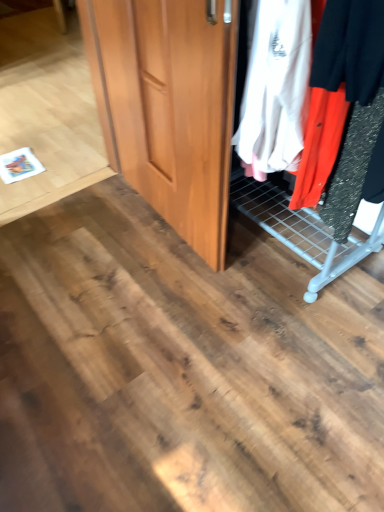
Question: Is wooden door at center not inside wooden wardrobe at center?

Choices:
 (A) yes
 (B) no

Answer: (A)

Question: From the image's perspective, does wooden door at center appear lower than wooden wardrobe at center?

Choices:
 (A) no
 (B) yes

Answer: (B)

Question: Is wooden door at center aimed at wooden wardrobe at center?

Choices:
 (A) yes
 (B) no

Answer: (B)

Question: Is wooden door at center not close to wooden wardrobe at center?

Choices:
 (A) yes
 (B) no

Answer: (B)

Question: From the image's perspective, does wooden door at center appear higher than wooden wardrobe at center?

Choices:
 (A) yes
 (B) no

Answer: (B)

Question: From a real-world perspective, is wooden door at center beneath wooden wardrobe at center?

Choices:
 (A) no
 (B) yes

Answer: (B)

Question: Is wooden wardrobe at center facing towards wooden door at center?

Choices:
 (A) yes
 (B) no

Answer: (A)

Question: Is wooden wardrobe at center in front of wooden door at center?

Choices:
 (A) yes
 (B) no

Answer: (A)

Question: From a real-world perspective, is wooden wardrobe at center positioned under wooden door at center based on gravity?

Choices:
 (A) yes
 (B) no

Answer: (B)

Question: Is wooden wardrobe at center directly adjacent to wooden door at center?

Choices:
 (A) no
 (B) yes

Answer: (A)

Question: Considering the relative sizes of wooden wardrobe at center and wooden door at center in the image provided, is wooden wardrobe at center thinner than wooden door at center?

Choices:
 (A) yes
 (B) no

Answer: (B)

Question: Considering the relative sizes of wooden wardrobe at center and wooden door at center in the image provided, is wooden wardrobe at center bigger than wooden door at center?

Choices:
 (A) yes
 (B) no

Answer: (A)

Question: Visually, is wooden wardrobe at center positioned to the left or to the right of wooden door at center?

Choices:
 (A) right
 (B) left

Answer: (A)